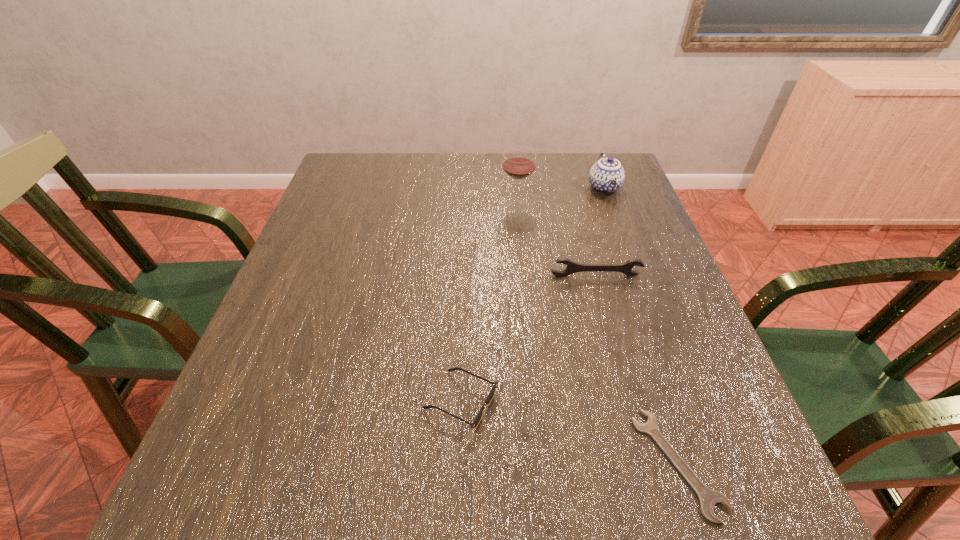
Locate an element on the screen. Image resolution: width=960 pixels, height=540 pixels. free space located from the spout of the chinaware is located at coordinates (651, 314).

Where is `vacant space located on the open ends of the third shortest object`? The width and height of the screenshot is (960, 540). vacant space located on the open ends of the third shortest object is located at coordinates (635, 421).

This screenshot has width=960, height=540. In order to click on vacant area located 0.200m on the lenses of the fourth tallest object in this screenshot , I will do `click(612, 401)`.

The width and height of the screenshot is (960, 540). In order to click on free location located 0.160m on the back of the shortest object in this screenshot , I will do `click(637, 338)`.

Find the location of `object that is at the far edge`. object that is at the far edge is located at coordinates (607, 175).

Identify the location of object located in the near edge section of the desktop. Image resolution: width=960 pixels, height=540 pixels. (708, 498).

Where is `chinaware positioned at the right edge`? chinaware positioned at the right edge is located at coordinates (607, 175).

Image resolution: width=960 pixels, height=540 pixels. What are the coordinates of `object that is at the far right corner` in the screenshot? It's located at (607, 175).

Find the location of `object located in the near right corner section of the desktop`. object located in the near right corner section of the desktop is located at coordinates (708, 498).

The width and height of the screenshot is (960, 540). In order to click on free space at the far edge in this screenshot , I will do `click(528, 187)`.